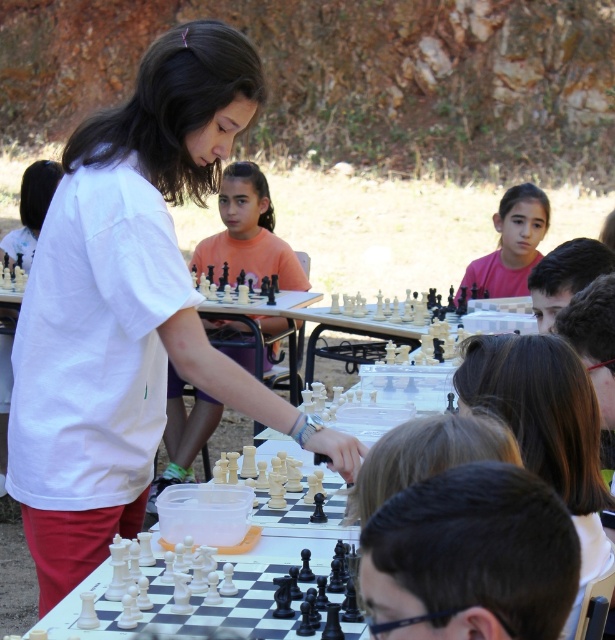
You are a photographer at the outdoor chess event. You need to capture a photo that includes both the matte white chess set at center and the pink matte shirt at upper center. Which object should you position closer to the camera to ensure both fit in the frame?

The matte white chess set at center is wider than the pink matte shirt at upper center. To ensure both fit in the frame, position the wider matte white chess set at center closer to the camera so its larger size can be accommodated while still including the pink matte shirt at upper center in the shot.

You are a photographer at the outdoor chess event. You need to capture a photo that includes both the white matte shirt at center and the pink matte shirt at upper center. Based on their positions, which shirt should you focus on first to ensure both are in the frame?

The white matte shirt at center is below the pink matte shirt at upper center, so you should focus on the pink matte shirt at upper center first to ensure both are in the frame.